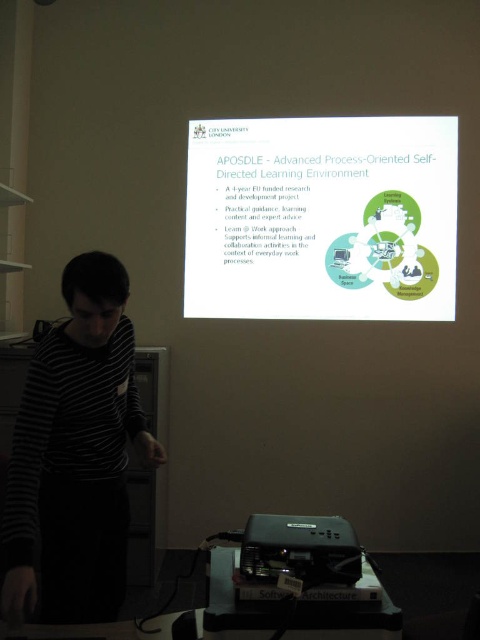
Question: Does white glossy projector screen at upper center have a lesser width compared to black striped shirt at left?

Choices:
 (A) yes
 (B) no

Answer: (B)

Question: Which point is closer to the camera?

Choices:
 (A) (325, 538)
 (B) (100, 589)

Answer: (A)

Question: Is white glossy projector screen at upper center below black plastic projector at lower center?

Choices:
 (A) yes
 (B) no

Answer: (B)

Question: Which point is closer to the camera?

Choices:
 (A) white glossy projector screen at upper center
 (B) black striped shirt at left
 (C) black plastic projector at lower center

Answer: (C)

Question: Is white glossy projector screen at upper center wider than black striped shirt at left?

Choices:
 (A) no
 (B) yes

Answer: (B)

Question: Which object appears farthest from the camera in this image?

Choices:
 (A) black plastic projector at lower center
 (B) black striped shirt at left

Answer: (B)